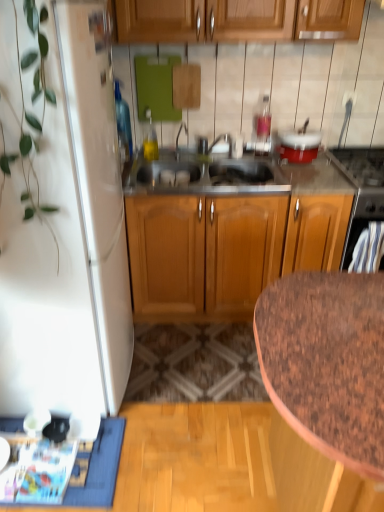
Locate an element on the screen. This screenshot has height=512, width=384. free space above red glossy pot at upper right, which is the 1th appliance in left-to-right order (from a real-world perspective) is located at coordinates (303, 140).